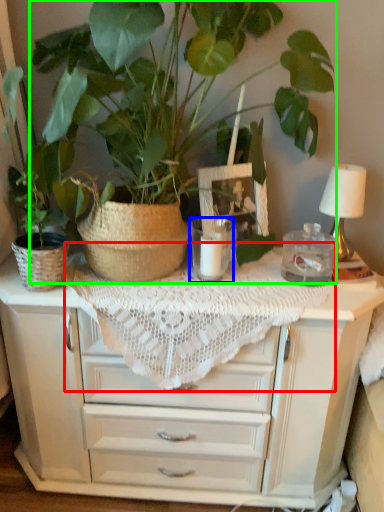
Question: Considering the real-world distances, which object is farthest from tablecloth (highlighted by a red box)? candle holder (highlighted by a blue box) or houseplant (highlighted by a green box)?

Choices:
 (A) candle holder
 (B) houseplant

Answer: (B)